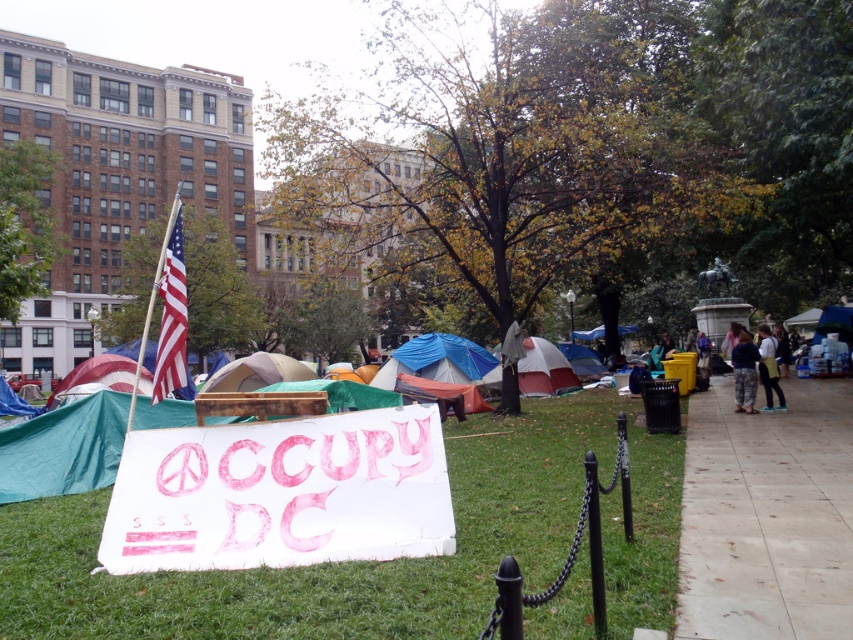
Question: Does white paper sign at center have a larger size compared to white canvas tent at center?

Choices:
 (A) yes
 (B) no

Answer: (B)

Question: Which point is farther to the camera?

Choices:
 (A) (465, 380)
 (B) (764, 372)
 (C) (570, 372)
 (D) (740, 390)

Answer: (C)

Question: Observing the image, what is the correct spatial positioning of white canvas tent at center in reference to camouflage pants at right?

Choices:
 (A) right
 (B) left

Answer: (B)

Question: Which point is farther from the camera taking this photo?

Choices:
 (A) (175, 284)
 (B) (142, 371)
 (C) (556, 388)
 (D) (727, 620)

Answer: (C)

Question: Can you confirm if green grass at center is positioned to the right of blue fabric tent at center?

Choices:
 (A) yes
 (B) no

Answer: (B)

Question: Which object is closer to the camera taking this photo?

Choices:
 (A) american flag at upper left
 (B) camouflage pants at right
 (C) white cotton shirt at right
 (D) blue fabric tent at center

Answer: (A)